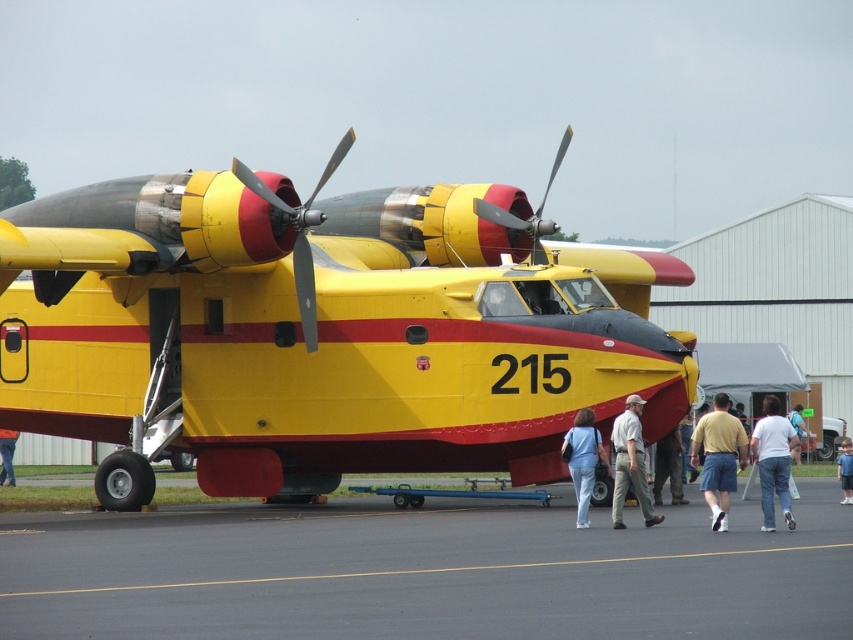
You are a photographer trying to capture a clear shot of the yellow matte propeller at center and the light blue shirt at center. If you want to ensure both are fully visible in your frame without cropping, which object should you consider the width of when adjusting your camera angle?

The yellow matte propeller at center might be wider than the light blue shirt at center, so you should consider the width of the yellow matte propeller at center to ensure both are fully visible.

You are an event attendee at the airshow and you see the yellow cotton shirt at center and denim pants at lower left. Which clothing item is positioned higher in the image?

The yellow cotton shirt at center is much taller than denim pants at lower left, so the yellow cotton shirt at center is positioned higher in the image.